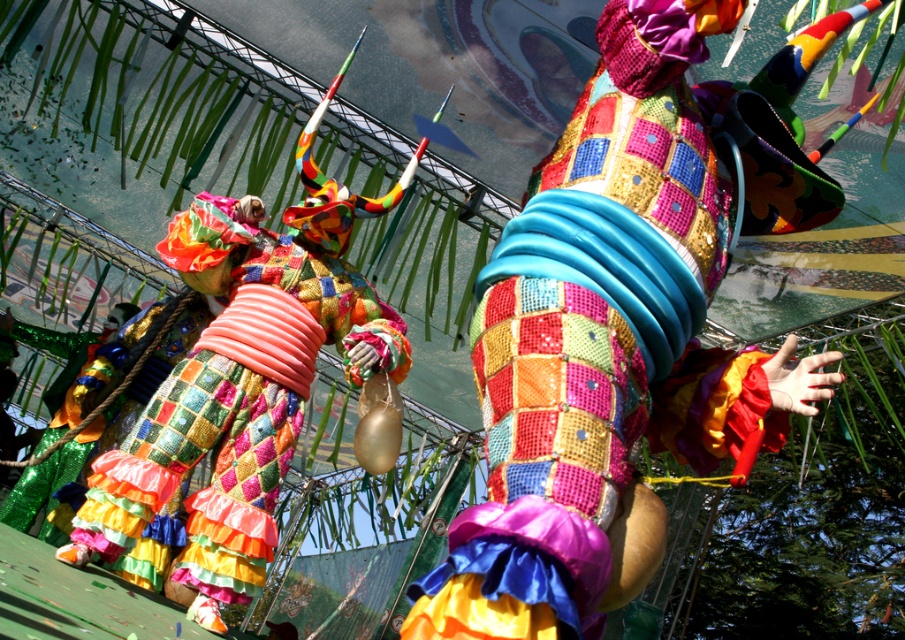
Question: Which object appears farthest from the camera in this image?

Choices:
 (A) multicolored sequined pants at center
 (B) multicolored sequined costume at center

Answer: (A)

Question: Where is multicolored sequined costume at center located in relation to multicolored sequined pants at center in the image?

Choices:
 (A) right
 (B) left

Answer: (A)

Question: Does multicolored sequined costume at center appear under multicolored sequined pants at center?

Choices:
 (A) yes
 (B) no

Answer: (B)

Question: Is multicolored sequined costume at center smaller than multicolored sequined pants at center?

Choices:
 (A) yes
 (B) no

Answer: (A)

Question: Which of the following is the farthest from the observer?

Choices:
 (A) 262,529
 (B) 602,116

Answer: (A)